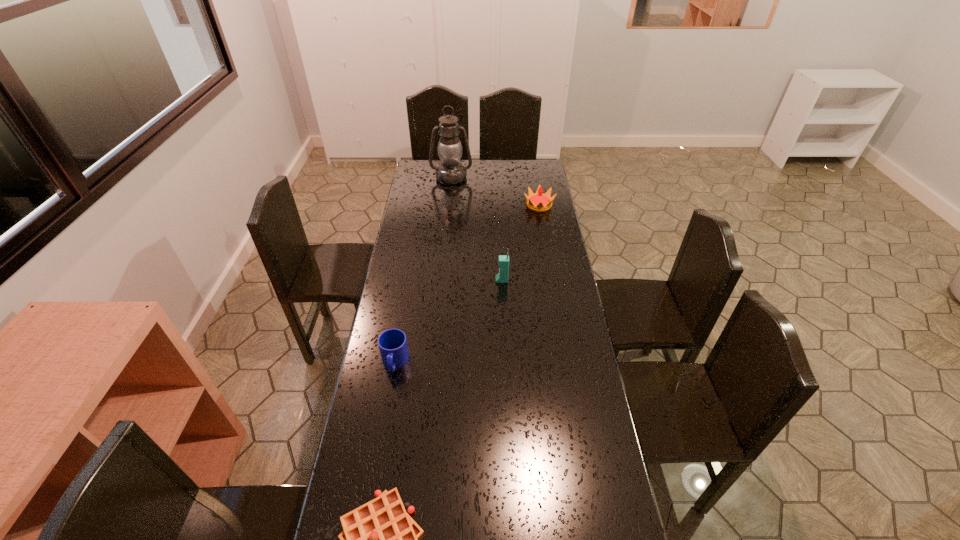
Choose which object is the fourth nearest neighbor to the second farthest object. Please provide its 2D coordinates. Your answer should be formatted as a tuple, i.e. [(x, y)], where the tuple contains the x and y coordinates of a point satisfying the conditions above.

[(379, 539)]

Find the location of a particular element. The image size is (960, 540). the second closest object to the fourth tallest object is located at coordinates (502, 277).

You are a GUI agent. You are given a task and a screenshot of the screen. Output one action in this format:
    pyautogui.click(x=<x>, y=<y>)
    Task: Click on the vacant region that satisfies the following two spatial constraints: 1. on the keypad of the fourth shortest object; 2. on the side with the handle of the fourth tallest object
    
    Given the screenshot: What is the action you would take?
    pyautogui.click(x=506, y=362)